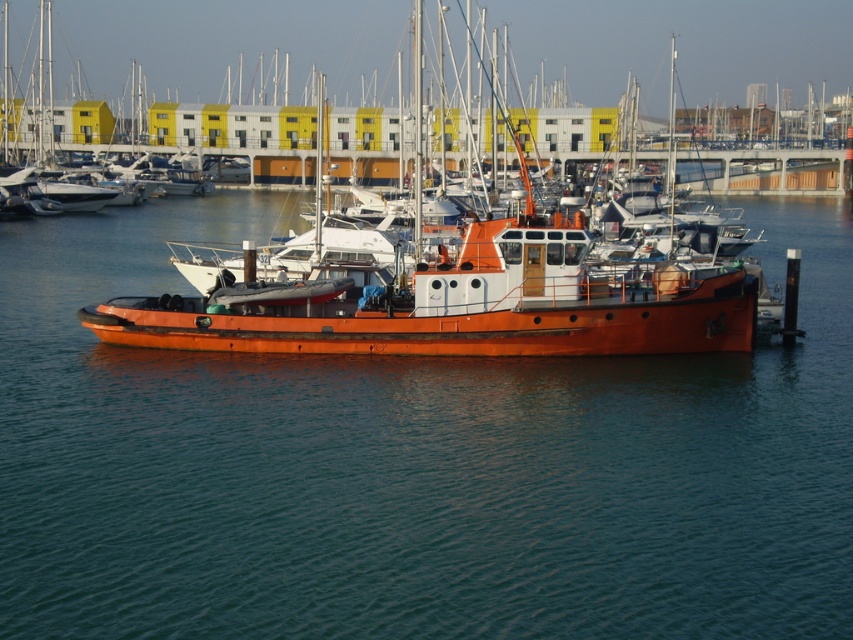
Which is below, glossy water at center or orange polished wood boat at center?

Positioned lower is glossy water at center.

Is glossy water at center thinner than orange polished wood boat at center?

No.

Which is behind, point (86, 333) or point (450, 328)?

The point (86, 333) is behind.

Where is `glossy water at center`? This screenshot has height=640, width=853. glossy water at center is located at coordinates (412, 465).